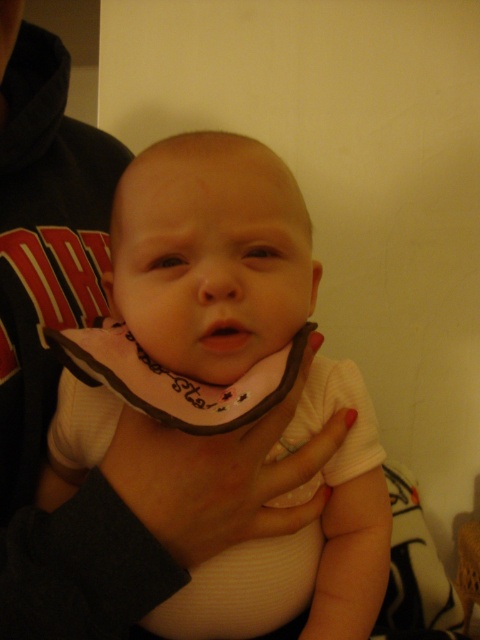
You are holding a baby in your arms and want to place a small toy near the point at coordinates point (83, 332). If the toy is 2 inches in diameter, will it fit comfortably without overlapping other objects?

The point at (83, 332) is 19.13 inches away from the viewer. Since the toy is only 2 inches in diameter, it will fit comfortably at that distance without overlapping other objects.

You are a photographer taking a close up photo of a baby. The baby is wearing a light colored, short sleeved onesie and a bib with a dark border and decorative elements. The baby is being held by someone whose arm and part of their torso are visible, wearing a dark colored garment with red lettering. You need to focus your camera on the baby. According to the image, where exactly is the white ribbed fabric baby at center located?

The white ribbed fabric baby at center is located at point (210, 252).

You are a photographer trying to capture the baby in the image. The baby is at the center, and you notice a point marked at coordinates (x=210, y=252). Based on the scene description, can you determine what object or feature this point corresponds to?

The point at coordinates (x=210, y=252) is on the white ribbed fabric baby at center.